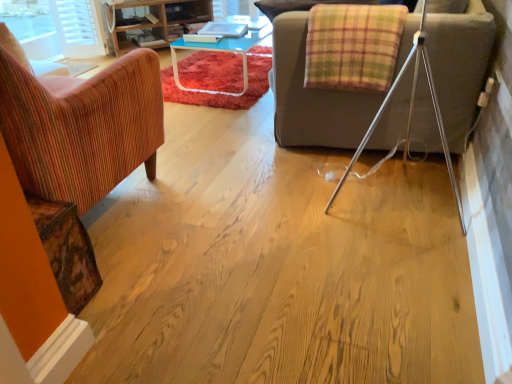
Question: Can you confirm if wooden shelves at upper left is thinner than wooden textured armchair at left?

Choices:
 (A) no
 (B) yes

Answer: (B)

Question: Is wooden shelves at upper left far from wooden textured armchair at left?

Choices:
 (A) yes
 (B) no

Answer: (A)

Question: Is wooden shelves at upper left behind wooden textured armchair at left?

Choices:
 (A) no
 (B) yes

Answer: (B)

Question: Does wooden shelves at upper left lie in front of wooden textured armchair at left?

Choices:
 (A) no
 (B) yes

Answer: (A)

Question: Does wooden shelves at upper left have a lesser height compared to wooden textured armchair at left?

Choices:
 (A) no
 (B) yes

Answer: (B)

Question: Does wooden shelves at upper left have a greater width compared to wooden textured armchair at left?

Choices:
 (A) no
 (B) yes

Answer: (A)

Question: Is plaid fabric blanket at upper right further to camera compared to wooden shelves at upper left?

Choices:
 (A) no
 (B) yes

Answer: (A)

Question: Considering the relative sizes of plaid fabric blanket at upper right and wooden shelves at upper left in the image provided, is plaid fabric blanket at upper right shorter than wooden shelves at upper left?

Choices:
 (A) yes
 (B) no

Answer: (A)

Question: Is plaid fabric blanket at upper right far from wooden shelves at upper left?

Choices:
 (A) no
 (B) yes

Answer: (B)

Question: Considering the relative sizes of plaid fabric blanket at upper right and wooden shelves at upper left in the image provided, is plaid fabric blanket at upper right taller than wooden shelves at upper left?

Choices:
 (A) yes
 (B) no

Answer: (B)

Question: From a real-world perspective, is plaid fabric blanket at upper right on wooden shelves at upper left?

Choices:
 (A) yes
 (B) no

Answer: (A)

Question: Can you confirm if plaid fabric blanket at upper right is positioned to the right of wooden shelves at upper left?

Choices:
 (A) no
 (B) yes

Answer: (B)

Question: From a real-world perspective, is wooden textured armchair at left under plaid fabric blanket at upper right?

Choices:
 (A) no
 (B) yes

Answer: (B)